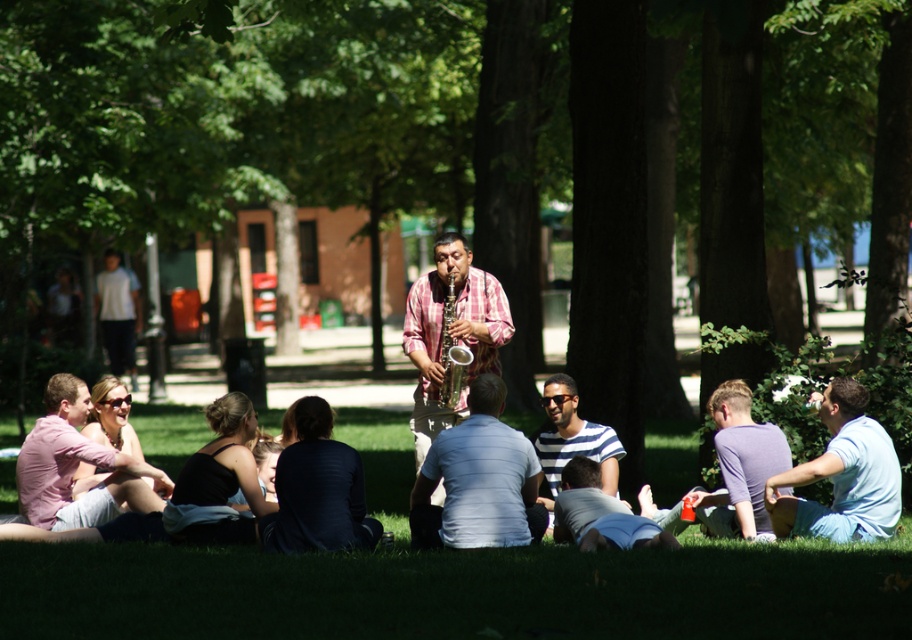
Question: Can you confirm if metallic saxophone at center is smaller than light blue shirt at center?

Choices:
 (A) yes
 (B) no

Answer: (B)

Question: Which object is closer to the camera taking this photo?

Choices:
 (A) green grass at center
 (B) metallic saxophone at center
 (C) light blue cotton shirt at center
 (D) light blue shirt at center

Answer: (A)

Question: Which point is closer to the camera taking this photo?

Choices:
 (A) (453, 320)
 (B) (140, 497)

Answer: (B)

Question: Which object appears closest to the camera in this image?

Choices:
 (A) light blue cotton shirt at lower right
 (B) gold metallic saxophone at center
 (C) matte pink shirt at lower left
 (D) green grass at center

Answer: (D)

Question: Is metallic saxophone at center wider than purple matte shirt at lower right?

Choices:
 (A) no
 (B) yes

Answer: (B)

Question: Can you confirm if striped cotton shirt at center is thinner than light blue shirt at center?

Choices:
 (A) no
 (B) yes

Answer: (B)